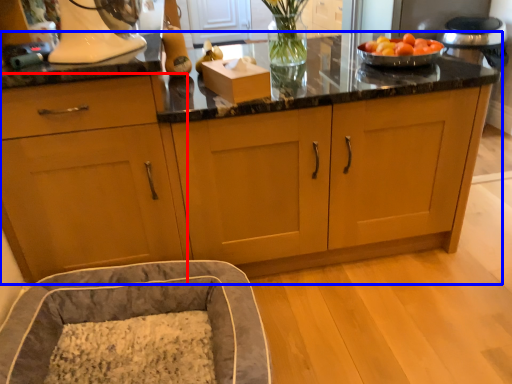
Question: Which object appears closest to the camera in this image, cabinetry (highlighted by a red box) or cabinetry (highlighted by a blue box)?

Choices:
 (A) cabinetry
 (B) cabinetry

Answer: (A)